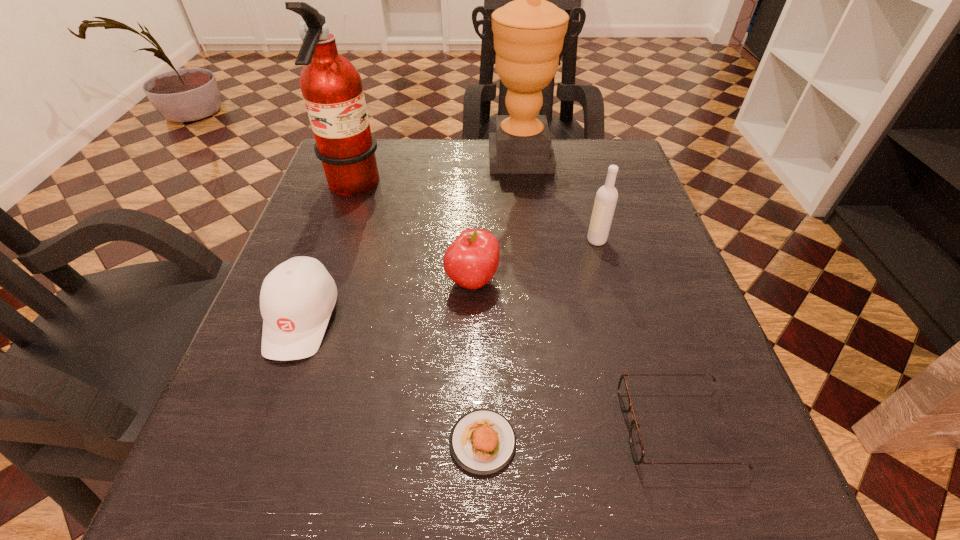
Find the location of a particular element. vacant area situated 0.070m on the front of the fifth nearest object is located at coordinates (606, 272).

Locate an element on the screen. This screenshot has width=960, height=540. free space located on the left of the apple is located at coordinates (396, 281).

Locate an element on the screen. vacant space situated 0.160m on the front-facing side of the fifth tallest object is located at coordinates (247, 470).

The width and height of the screenshot is (960, 540). Find the location of `vacant space located on the front-facing side of the second shortest object`. vacant space located on the front-facing side of the second shortest object is located at coordinates (502, 427).

Identify the location of vacant space located 0.270m on the front-facing side of the second shortest object. The image size is (960, 540). (430, 427).

Where is `free region located 0.330m on the front-facing side of the second shortest object`? free region located 0.330m on the front-facing side of the second shortest object is located at coordinates [386, 427].

You are a GUI agent. You are given a task and a screenshot of the screen. Output one action in this format:
    pyautogui.click(x=<x>, y=<y>)
    Task: Click on the free point located on the left of the shortest object
    Image resolution: width=960 pixels, height=540 pixels.
    Given the screenshot: What is the action you would take?
    pyautogui.click(x=412, y=442)

Where is `award located in the far edge section of the desktop`? award located in the far edge section of the desktop is located at coordinates (529, 32).

Locate an element on the screen. Image resolution: width=960 pixels, height=540 pixels. fire extinguisher present at the far edge is located at coordinates (331, 86).

I want to click on sunglasses that is at the near edge, so click(636, 445).